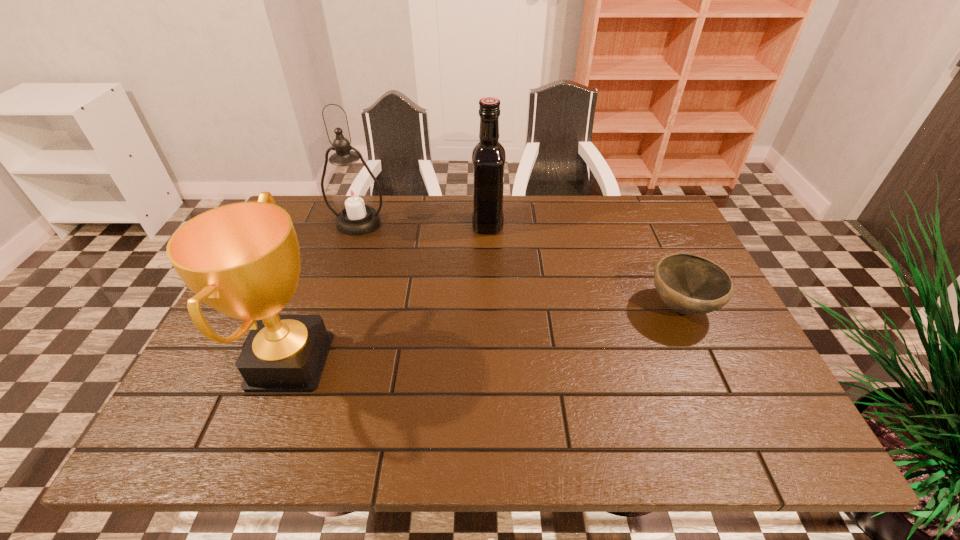
Where is `vacant area at the near edge of the desktop`? vacant area at the near edge of the desktop is located at coordinates (486, 446).

What are the coordinates of `vacant space at the left edge of the desktop` in the screenshot? It's located at (307, 243).

In the image, there is a desktop. At what (x,y) coordinates should I click in order to perform the action: click on vacant area at the far right corner. Please return your answer as a coordinate pair (x, y). The height and width of the screenshot is (540, 960). Looking at the image, I should click on (660, 242).

The image size is (960, 540). Find the location of `unoccupied area between the oil lamp and the award`. unoccupied area between the oil lamp and the award is located at coordinates (324, 292).

Locate an element on the screen. unoccupied position between the award and the third object from left to right is located at coordinates (389, 293).

This screenshot has height=540, width=960. What are the coordinates of `empty space between the oil lamp and the award` in the screenshot? It's located at (324, 292).

This screenshot has width=960, height=540. Identify the location of vacant area between the award and the liquor. (389, 293).

At what (x,y) coordinates should I click in order to perform the action: click on free point between the rightmost object and the third object from left to right. Please return your answer as a coordinate pair (x, y). This screenshot has height=540, width=960. Looking at the image, I should click on (585, 266).

I want to click on free point between the award and the oil lamp, so click(x=324, y=292).

Find the location of a particular element. The image size is (960, 540). vacant point located between the bowl and the third object from left to right is located at coordinates (585, 266).